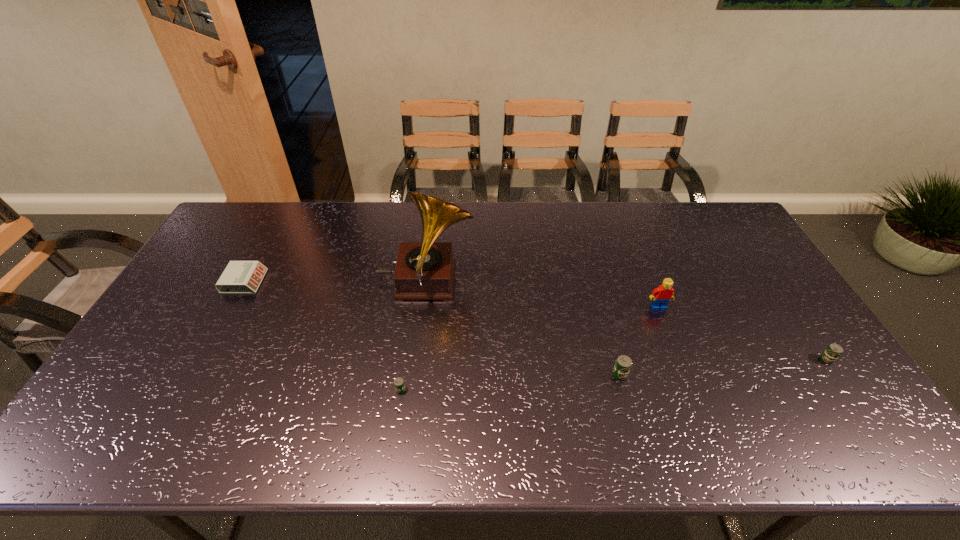
Identify the location of empty location between the phonograph record and the tallest beer can. point(522,328).

This screenshot has height=540, width=960. I want to click on object that stands as the closest to the leftmost beer can, so click(425, 270).

Choose which object is the third nearest neighbor to the second beer can from left to right. Please provide its 2D coordinates. Your answer should be formatted as a tuple, i.e. [(x, y)], where the tuple contains the x and y coordinates of a point satisfying the conditions above.

[(833, 351)]

Find the location of a particular element. The image size is (960, 540). beer can that stands as the second closest to the rightmost beer can is located at coordinates (399, 384).

Locate which beer can ranks second in proximity to the phonograph record. Please provide its 2D coordinates. Your answer should be formatted as a tuple, i.e. [(x, y)], where the tuple contains the x and y coordinates of a point satisfying the conditions above.

[(623, 364)]

The height and width of the screenshot is (540, 960). I want to click on free space in the image that satisfies the following two spatial constraints: 1. on the face of the second shortest beer can; 2. on the left side of the second object from right to left, so click(x=679, y=360).

In order to click on free point that satisfies the following two spatial constraints: 1. from the horn of the tallest object; 2. on the right side of the third tallest object in this screenshot , I will do `click(414, 374)`.

Locate an element on the screen. Image resolution: width=960 pixels, height=540 pixels. vacant point that satisfies the following two spatial constraints: 1. on the front side of the fourth shortest object; 2. on the left side of the alarm clock is located at coordinates (194, 374).